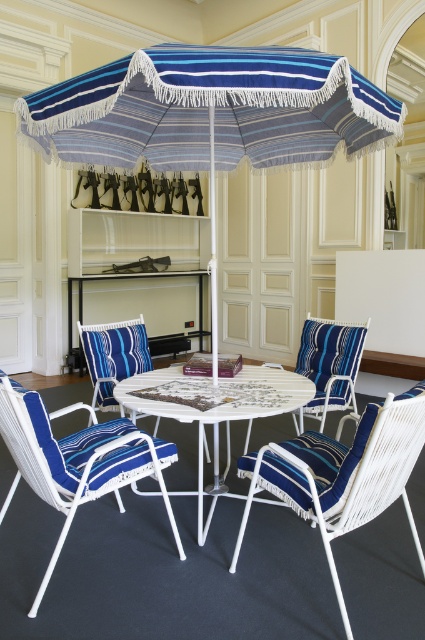
Does blue striped fabric umbrella at center appear on the left side of blue striped fabric chair at center?

Yes, blue striped fabric umbrella at center is to the left of blue striped fabric chair at center.

Does blue striped fabric umbrella at center come in front of blue striped fabric chair at center?

Yes, blue striped fabric umbrella at center is closer to the viewer.

Is point (248, 145) less distant than point (345, 380)?

That is True.

Locate an element on the screen. The height and width of the screenshot is (640, 425). blue striped fabric umbrella at center is located at coordinates (212, 115).

This screenshot has width=425, height=640. What do you see at coordinates (342, 474) in the screenshot?
I see `blue striped cushioned chair at center` at bounding box center [342, 474].

Is blue striped cushioned chair at center behind white wicker table at center?

No, blue striped cushioned chair at center is closer to the viewer.

Is point (323, 524) more distant than point (158, 376)?

No, it is not.

Where is `blue striped cushioned chair at center`? This screenshot has width=425, height=640. blue striped cushioned chair at center is located at coordinates (342, 474).

Is blue striped cushioned chair at center in front of blue striped fabric armchair at center?

Yes, it is.

Is the position of blue striped cushioned chair at center more distant than that of blue striped fabric armchair at center?

No.

Is point (393, 461) more distant than point (121, 348)?

No.

Find the location of `blue striped cushioned chair at center`. blue striped cushioned chair at center is located at coordinates (342, 474).